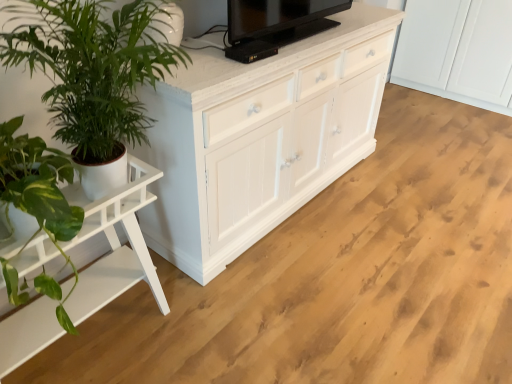
Question: Could you tell me if white wood table at left is facing black glossy tv at upper center?

Choices:
 (A) yes
 (B) no

Answer: (B)

Question: Is white wood table at left oriented away from black glossy tv at upper center?

Choices:
 (A) no
 (B) yes

Answer: (A)

Question: From the image's perspective, is white wood table at left on black glossy tv at upper center?

Choices:
 (A) yes
 (B) no

Answer: (B)

Question: Is white wood table at left at the right side of black glossy tv at upper center?

Choices:
 (A) no
 (B) yes

Answer: (A)

Question: Can you confirm if white wood table at left is bigger than black glossy tv at upper center?

Choices:
 (A) yes
 (B) no

Answer: (A)

Question: Is white wood table at left to the left or to the right of green leafy plant at left in the image?

Choices:
 (A) left
 (B) right

Answer: (A)

Question: From their relative heights in the image, would you say white wood table at left is taller or shorter than green leafy plant at left?

Choices:
 (A) tall
 (B) short

Answer: (A)

Question: Is white wood table at left spatially inside green leafy plant at left, or outside of it?

Choices:
 (A) inside
 (B) outside

Answer: (B)

Question: Looking at their shapes, would you say white wood table at left is wider or thinner than green leafy plant at left?

Choices:
 (A) wide
 (B) thin

Answer: (B)

Question: Is green leafy plant at left situated inside black glossy tv at upper center or outside?

Choices:
 (A) inside
 (B) outside

Answer: (B)

Question: Is green leafy plant at left wider or thinner than black glossy tv at upper center?

Choices:
 (A) thin
 (B) wide

Answer: (B)

Question: Visually, is green leafy plant at left positioned to the left or to the right of black glossy tv at upper center?

Choices:
 (A) right
 (B) left

Answer: (B)

Question: Is point (75, 62) positioned closer to the camera than point (282, 26)?

Choices:
 (A) farther
 (B) closer

Answer: (B)

Question: Considering the positions of point (258, 21) and point (96, 29), is point (258, 21) closer or farther from the camera than point (96, 29)?

Choices:
 (A) farther
 (B) closer

Answer: (A)

Question: From a real-world perspective, relative to green leafy plant at left, is black glossy tv at upper center vertically above or below?

Choices:
 (A) below
 (B) above

Answer: (B)